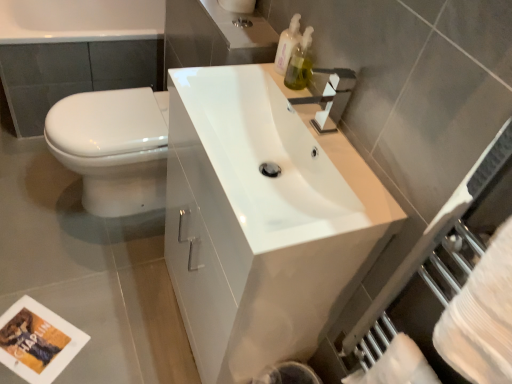
Question: From the image's perspective, is white glossy toilet at left under translucent plastic soap dispenser at upper right, which is the 1th soap dispenser from bottom to top?

Choices:
 (A) no
 (B) yes

Answer: (B)

Question: Does white glossy toilet at left have a lesser width compared to translucent plastic soap dispenser at upper right, which appears as the 2th soap dispenser when viewed from the top?

Choices:
 (A) yes
 (B) no

Answer: (B)

Question: Is white glossy toilet at left not within translucent plastic soap dispenser at upper right, which appears as the 2th soap dispenser when viewed from the top?

Choices:
 (A) yes
 (B) no

Answer: (A)

Question: Is white glossy toilet at left wider than translucent plastic soap dispenser at upper right, which is the 1th soap dispenser from bottom to top?

Choices:
 (A) no
 (B) yes

Answer: (B)

Question: Is translucent plastic soap dispenser at upper right, which is the 1th soap dispenser from bottom to top, inside white glossy toilet at left?

Choices:
 (A) no
 (B) yes

Answer: (A)

Question: From a real-world perspective, is white glossy toilet at left below translucent plastic soap dispenser at upper right, which appears as the 2th soap dispenser when viewed from the top?

Choices:
 (A) no
 (B) yes

Answer: (B)

Question: Is white glossy sink at center positioned beyond the bounds of translucent plastic soap dispenser at upper right, which appears as the 2th soap dispenser when viewed from the top?

Choices:
 (A) no
 (B) yes

Answer: (B)

Question: Does white glossy sink at center appear on the left side of translucent plastic soap dispenser at upper right, which is the 1th soap dispenser from bottom to top?

Choices:
 (A) yes
 (B) no

Answer: (A)

Question: Does white glossy sink at center have a greater height compared to translucent plastic soap dispenser at upper right, which is the 1th soap dispenser from bottom to top?

Choices:
 (A) no
 (B) yes

Answer: (B)

Question: Is white glossy sink at center smaller than translucent plastic soap dispenser at upper right, which appears as the 2th soap dispenser when viewed from the top?

Choices:
 (A) yes
 (B) no

Answer: (B)

Question: From the image's perspective, is white glossy sink at center under translucent plastic soap dispenser at upper right, which appears as the 2th soap dispenser when viewed from the top?

Choices:
 (A) no
 (B) yes

Answer: (B)

Question: Could you tell me if white glossy sink at center is facing translucent plastic soap dispenser at upper right, which appears as the 2th soap dispenser when viewed from the top?

Choices:
 (A) yes
 (B) no

Answer: (B)

Question: Is there a large distance between white glossy sink at center and translucent plastic soap dispenser at upper right, the 2th soap dispenser from the bottom?

Choices:
 (A) yes
 (B) no

Answer: (B)